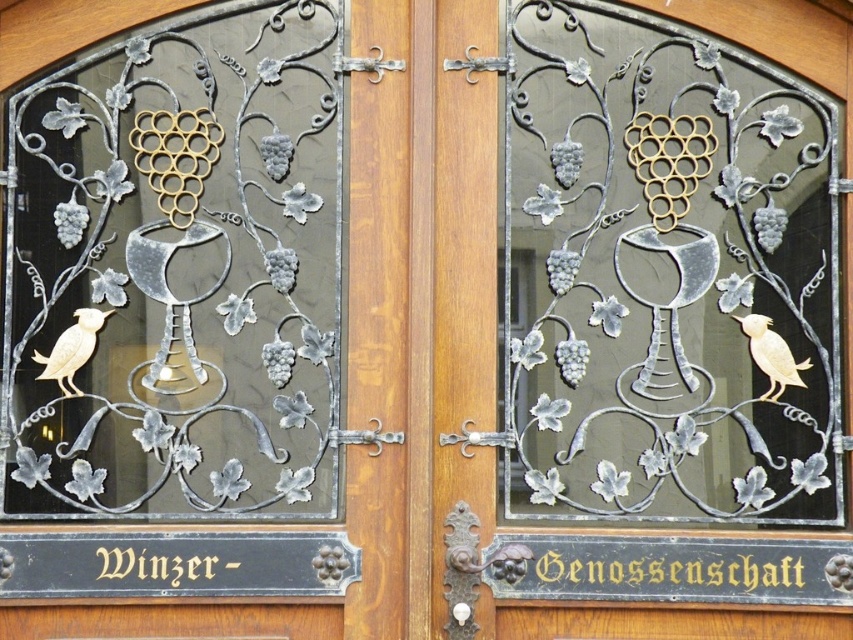
Looking at this image, you are an interior designer assessing the symmetry of the doors. The left door has a matte silver chalice at center and the right door has a gold matte bird at right. Which object is placed higher on its respective door panel?

The matte silver chalice at center is positioned higher than the gold matte bird at right on their respective door panels.

You are an interior designer assessing the symmetry of the doors. The left door has a matte silver chalice at center and the right door has a gold matte bird at right. Which object is taller?

The matte silver chalice at center is much taller than the gold matte bird at right.